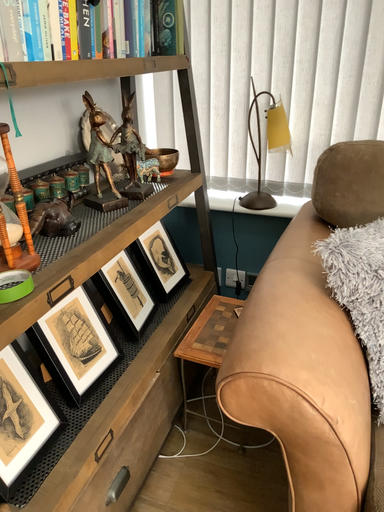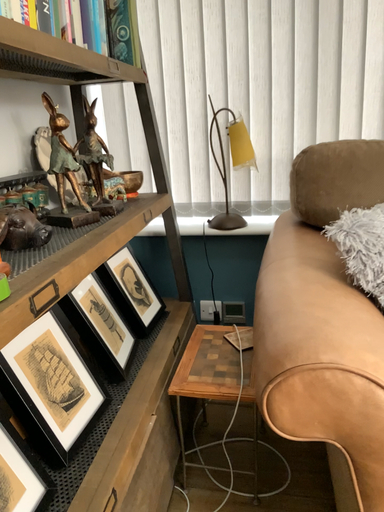
Question: Which way did the camera rotate in the video?

Choices:
 (A) rotated left
 (B) rotated right

Answer: (B)